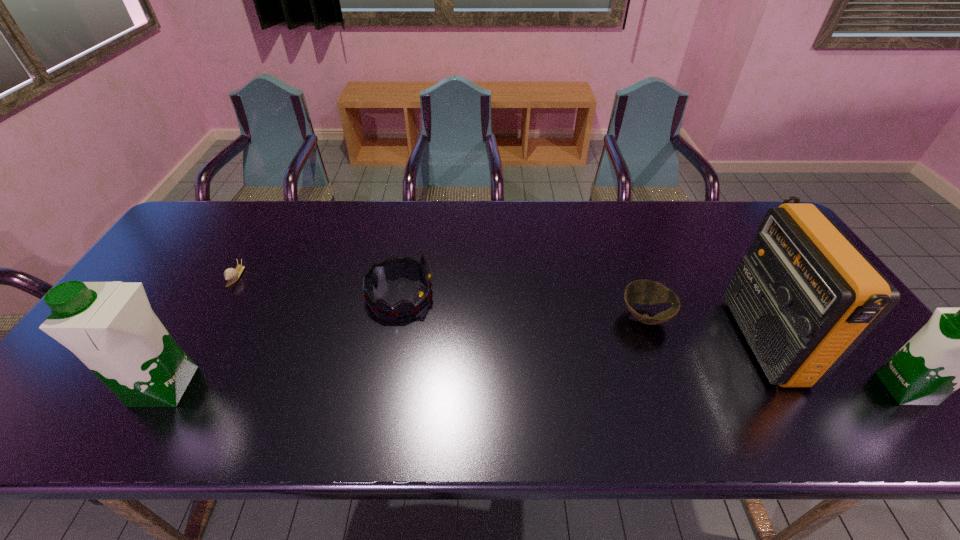
Locate an element on the screen. This screenshot has width=960, height=540. vacant region located on the front-facing side of the shorter soya milk is located at coordinates (807, 389).

Identify the location of vacant space located 0.180m on the front-facing side of the shorter soya milk. (803, 389).

You are a GUI agent. You are given a task and a screenshot of the screen. Output one action in this format:
    pyautogui.click(x=<x>, y=<y>)
    Task: Click on the blank space located 0.260m on the shell of the escargot
    
    Given the screenshot: What is the action you would take?
    pyautogui.click(x=185, y=364)

Where is `vacant region located on the back of the bowl`? vacant region located on the back of the bowl is located at coordinates (631, 275).

This screenshot has height=540, width=960. What are the coordinates of `free space located at the front of the third shortest object with jewels` in the screenshot? It's located at (573, 294).

At what (x,y) coordinates should I click in order to perform the action: click on vacant position located 0.150m on the front-facing side of the fifth object from left to right. Please return your answer as a coordinate pair (x, y). Looking at the image, I should click on (681, 340).

Identify the location of vacant space situated 0.360m on the front-facing side of the fifth object from left to right. The height and width of the screenshot is (540, 960). (598, 340).

Locate an element on the screen. vacant region located 0.280m on the front-facing side of the fifth object from left to right is located at coordinates (630, 340).

You are a GUI agent. You are given a task and a screenshot of the screen. Output one action in this format:
    pyautogui.click(x=<x>, y=<y>)
    Task: Click on the radio receiver positioned at the near edge
    
    Given the screenshot: What is the action you would take?
    tap(804, 296)

Where is `object that is at the right edge`? The height and width of the screenshot is (540, 960). object that is at the right edge is located at coordinates (957, 348).